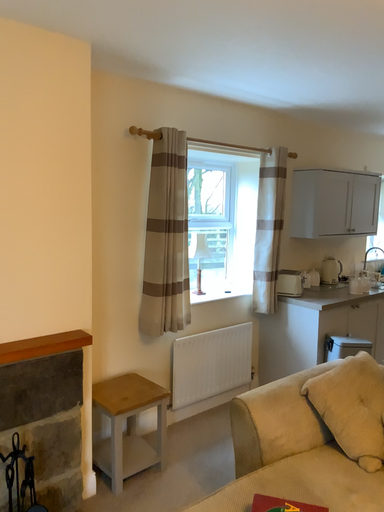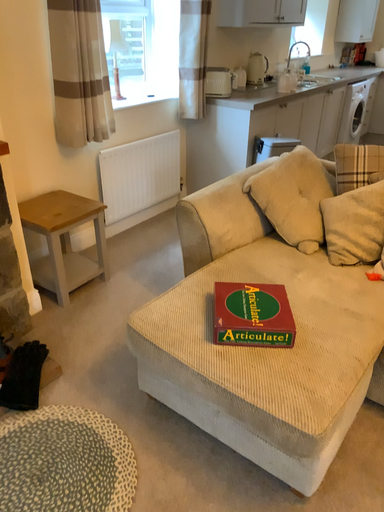
Question: How did the camera likely rotate when shooting the video?

Choices:
 (A) rotated left
 (B) rotated right

Answer: (B)